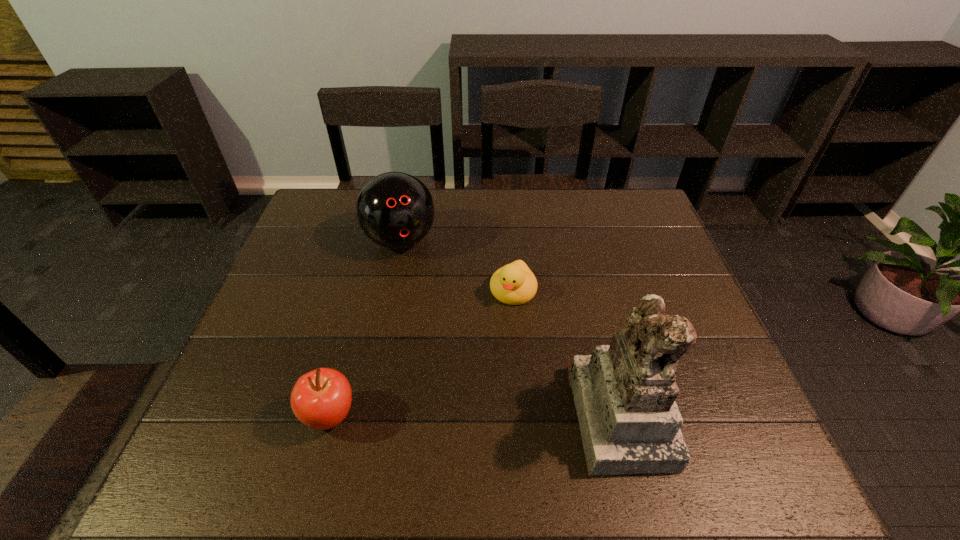
This screenshot has width=960, height=540. In order to click on vacant space located 0.280m on the face of the third nearest object in this screenshot , I will do `click(468, 399)`.

Locate an element on the screen. The height and width of the screenshot is (540, 960). vacant area located on the face of the third nearest object is located at coordinates (492, 343).

Locate an element on the screen. Image resolution: width=960 pixels, height=540 pixels. blank area located on the surface of the bowling ball near the finger holes is located at coordinates (447, 373).

I want to click on blank area located on the surface of the bowling ball near the finger holes, so click(420, 297).

I want to click on blank space located 0.070m on the surface of the bowling ball near the finger holes, so pyautogui.click(x=415, y=280).

Identify the location of object that is at the far edge. (395, 210).

Find the location of `apple that is at the near edge`. apple that is at the near edge is located at coordinates (321, 399).

Where is `figurine situated at the near edge`? The height and width of the screenshot is (540, 960). figurine situated at the near edge is located at coordinates (624, 393).

At what (x,y) coordinates should I click in order to perform the action: click on vacant space at the far edge of the desktop. Please return your answer as a coordinate pair (x, y). This screenshot has height=540, width=960. Looking at the image, I should click on (458, 191).

Find the location of a particular element. vacant space at the near edge of the desktop is located at coordinates (563, 406).